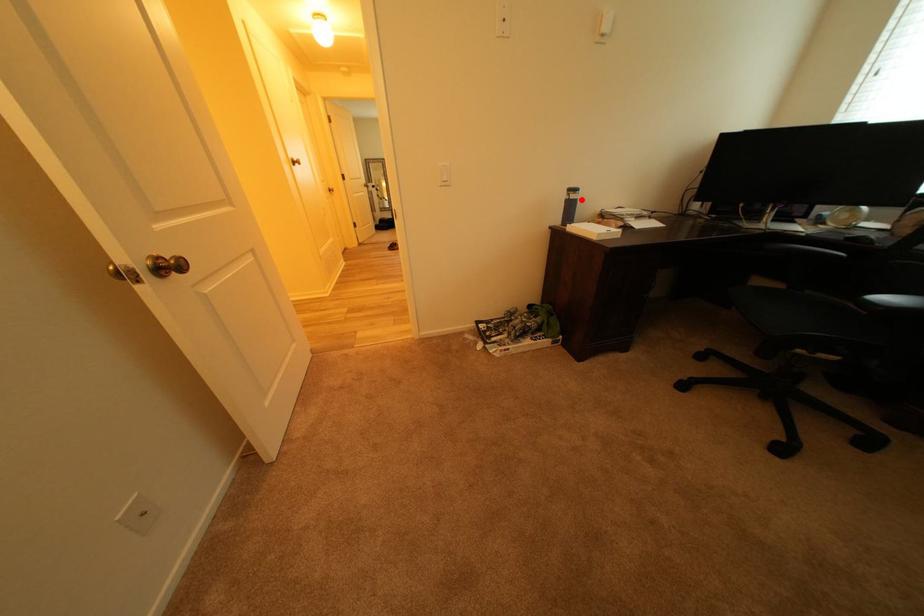
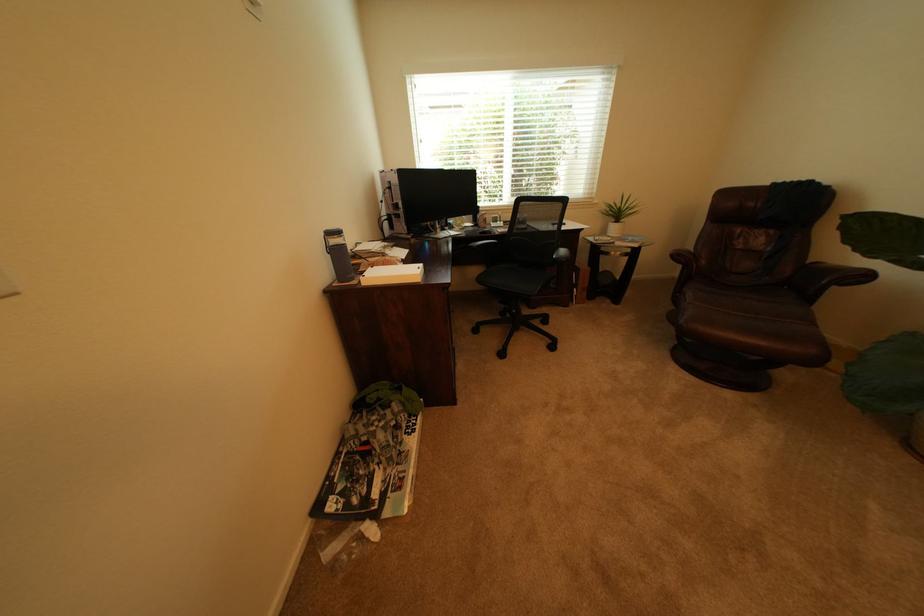
Where in the second image is the point corresponding to the highlighted location from the first image?

(342, 246)